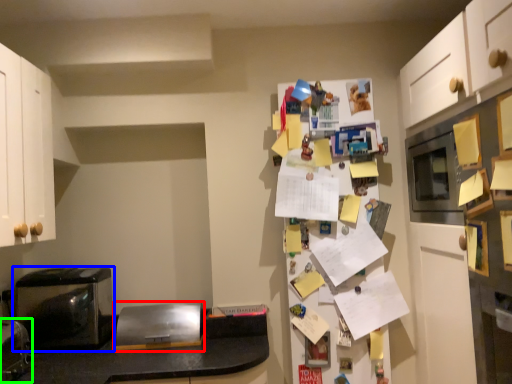
Question: Based on their relative distances, which object is farther from appliance (highlighted by a red box)? Choose from home appliance (highlighted by a blue box) and appliance (highlighted by a green box).

Choices:
 (A) home appliance
 (B) appliance

Answer: (B)